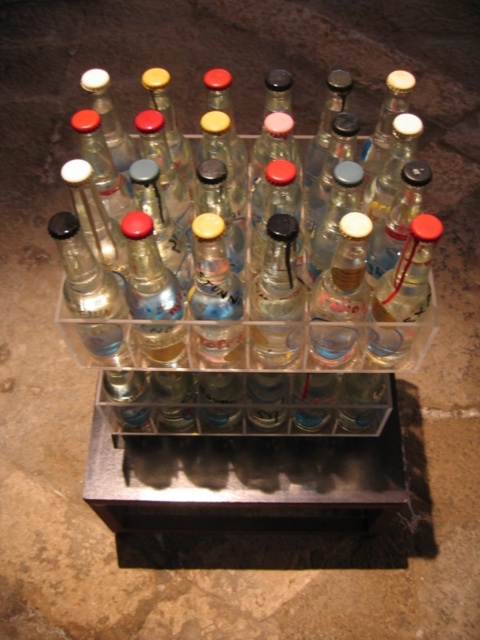
You are organizing a display of beverages. You have two clear glass bottles at center and a clear glass bottle at center. Which one is positioned to the left?

The clear glass bottles at center is positioned to the left of the clear glass bottle at center.